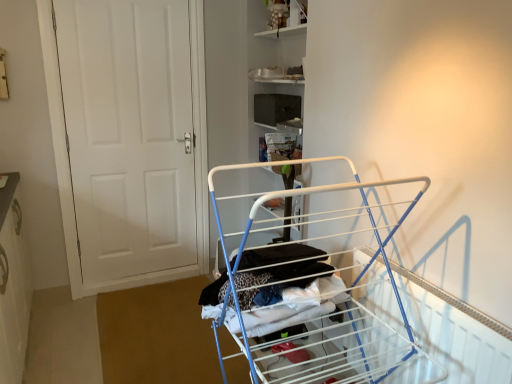
What is the approximate height of metallic silver shelf at upper center?

The height of metallic silver shelf at upper center is 7.63 inches.

From the picture: In order to face white metal drying rack at center, should I rotate leftwards or rightwards?

Turn right approximately 7.532 degrees to face it.

You are a GUI agent. You are given a task and a screenshot of the screen. Output one action in this format:
    pyautogui.click(x=<x>, y=<y>)
    Task: Click on the metallic silver shelf at upper center
    Image resolution: width=512 pixels, height=384 pixels.
    Given the screenshot: What is the action you would take?
    pyautogui.click(x=285, y=18)

This screenshot has width=512, height=384. I want to click on door below the metallic silver shelf at upper center (from the image's perspective), so click(129, 139).

Which object is closer to the camera, metallic silver shelf at upper center or white matte door at left?

white matte door at left.

Is point (287, 14) closer or farther from the camera than point (79, 38)?

Point (287, 14) appears to be closer to the viewer than point (79, 38).

Considering the positions of objects metallic silver shelf at upper center and white matte door at left in the image provided, who is more to the left, metallic silver shelf at upper center or white matte door at left?

white matte door at left.

Consider the image. Are white matte door at left and white metal drying rack at center making contact?

No.

Is white metal drying rack at center surrounded by white matte door at left?

No, white metal drying rack at center is not surrounded by white matte door at left.

Consider the image. From the image's perspective, which one is positioned lower, white matte door at left or white metal drying rack at center?

white metal drying rack at center is shown below in the image.

Which object is wider, white matte door at left or white metal drying rack at center?

white metal drying rack at center.

From the image's perspective, who appears lower, white metal drying rack at center or metallic silver shelf at upper center?

white metal drying rack at center.

Is white metal drying rack at center thinner than metallic silver shelf at upper center?

No.

Does white matte door at left lie behind metallic silver shelf at upper center?

No, the depth of white matte door at left is less than that of metallic silver shelf at upper center.

Where is `door below the metallic silver shelf at upper center (from the image's perspective)`? Image resolution: width=512 pixels, height=384 pixels. door below the metallic silver shelf at upper center (from the image's perspective) is located at coordinates (129, 139).

Does white matte door at left touch metallic silver shelf at upper center?

There is a gap between white matte door at left and metallic silver shelf at upper center.

From the image's perspective, is white metal drying rack at center located above or below white matte door at left?

Clearly, from the image's perspective, white metal drying rack at center is below white matte door at left.

Is white metal drying rack at center wider or thinner than white matte door at left?

white metal drying rack at center is wider than white matte door at left.

Is white metal drying rack at center situated inside white matte door at left or outside?

white metal drying rack at center lies outside white matte door at left.

Is point (333, 374) positioned behind point (84, 267)?

No, (333, 374) is closer to viewer.

Is point (278, 37) positioned in front of point (264, 279)?

No, (278, 37) is further to viewer.

From a real-world perspective, is metallic silver shelf at upper center positioned above or below white metal drying rack at center?

metallic silver shelf at upper center is above white metal drying rack at center.

Looking at this image, choose the correct answer: Is metallic silver shelf at upper center inside white metal drying rack at center or outside it?

metallic silver shelf at upper center cannot be found inside white metal drying rack at center.

Between metallic silver shelf at upper center and white metal drying rack at center, which one has smaller size?

With smaller size is metallic silver shelf at upper center.

I want to click on door that is in front of the metallic silver shelf at upper center, so click(x=129, y=139).

The width and height of the screenshot is (512, 384). In order to click on furniture lying on the right of white matte door at left in this screenshot , I will do `click(312, 293)`.

Looking at the image, which one is located closer to white matte door at left, white metal drying rack at center or metallic silver shelf at upper center?

metallic silver shelf at upper center lies closer to white matte door at left than the other object.

Considering their positions, is metallic silver shelf at upper center positioned closer to white metal drying rack at center than white matte door at left?

Result: Based on the image, white matte door at left appears to be nearer to white metal drying rack at center.

Which object lies further to the anchor point metallic silver shelf at upper center, white metal drying rack at center or white matte door at left?

white metal drying rack at center.

From the image, which object appears to be nearer to white metal drying rack at center, white matte door at left or metallic silver shelf at upper center?

Among the two, white matte door at left is located nearer to white metal drying rack at center.

Which object lies nearer to the anchor point metallic silver shelf at upper center, white matte door at left or white metal drying rack at center?

white matte door at left lies closer to metallic silver shelf at upper center than the other object.

When comparing their distances from white matte door at left, does metallic silver shelf at upper center or white metal drying rack at center seem further?

white metal drying rack at center lies further to white matte door at left than the other object.

Where is `door between white metal drying rack at center and metallic silver shelf at upper center in the front-back direction`? Image resolution: width=512 pixels, height=384 pixels. door between white metal drying rack at center and metallic silver shelf at upper center in the front-back direction is located at coordinates (129, 139).